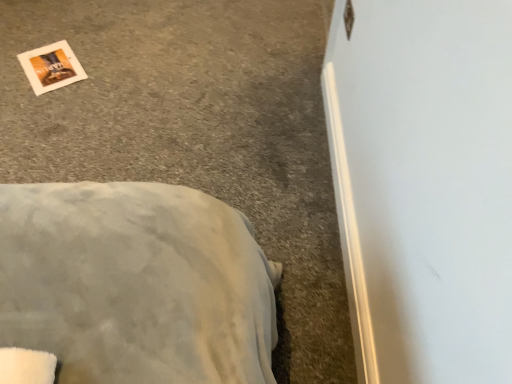
Where is `vacant location below white paper at upper left (from a real-world perspective)`? vacant location below white paper at upper left (from a real-world perspective) is located at coordinates click(x=46, y=65).